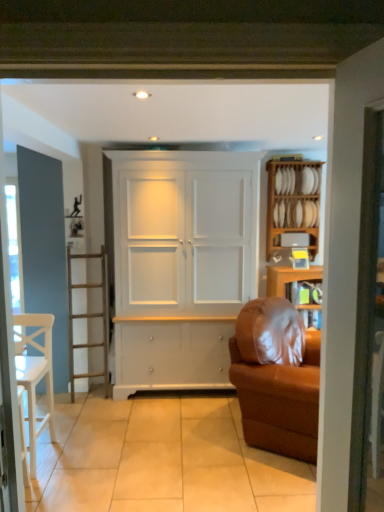
The width and height of the screenshot is (384, 512). I want to click on vacant point above white wooden shelf at upper right, the 2th shelf from the top (from a real-world perspective), so 304,229.